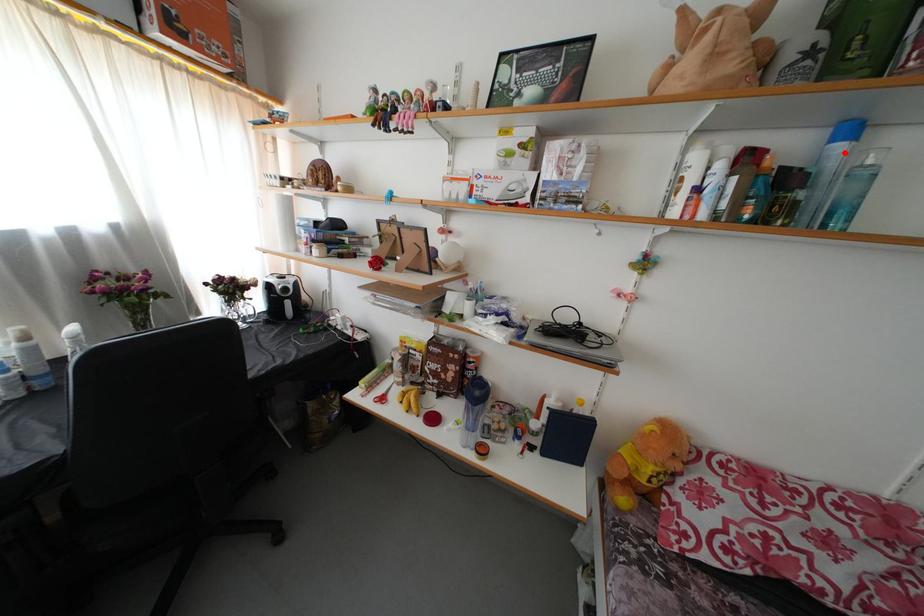
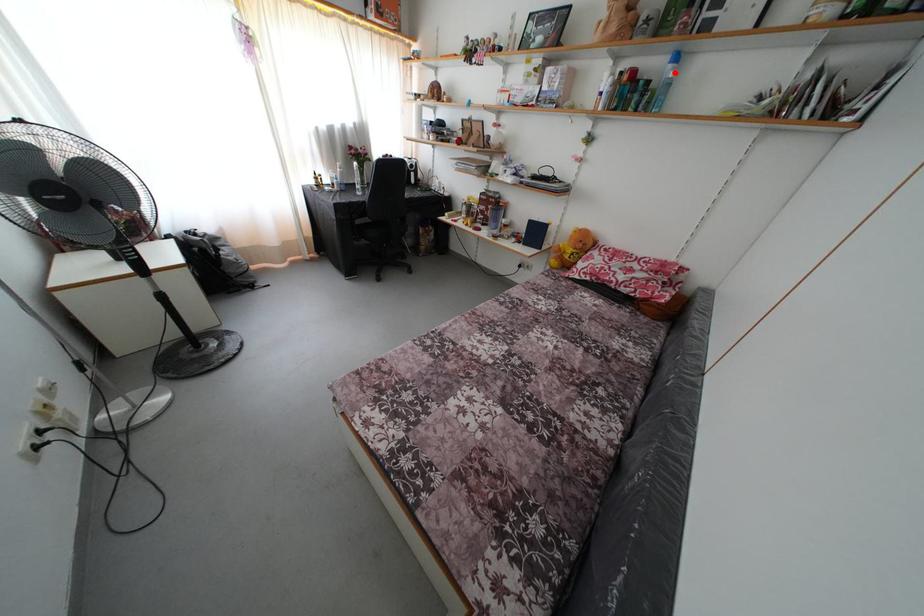
I am providing you with two images of the same scene from different viewpoints. A red point is marked on the first image and another point is marked on the second image. Are the points marked in image1 and image2 representing the same 3D position?

Yes